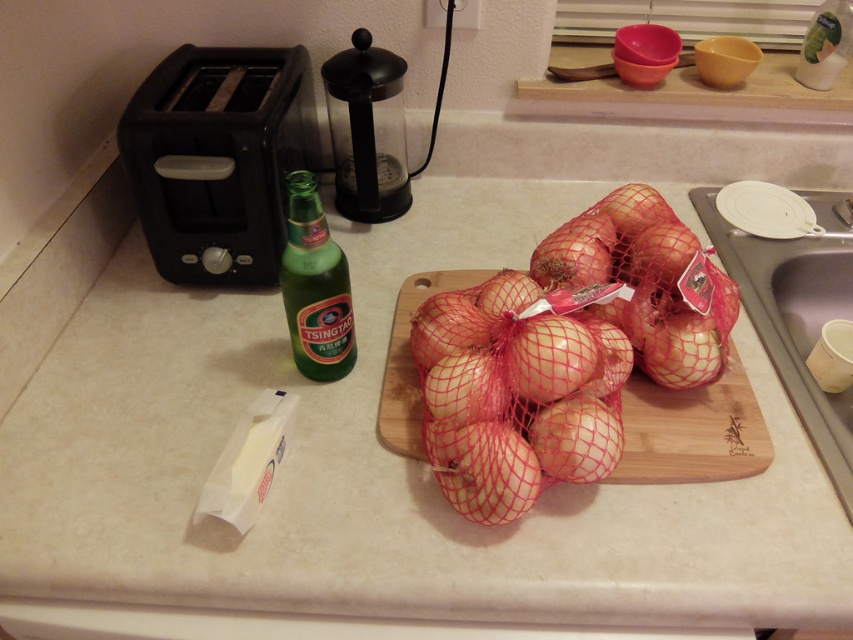
Question: Among these points, which one is nearest to the camera?

Choices:
 (A) (189, 228)
 (B) (625, 444)
 (C) (323, 296)
 (D) (798, 68)

Answer: (C)

Question: Estimate the real-world distances between objects in this image. Which object is closer to the black plastic toaster at left?

Choices:
 (A) clear plastic bottle at upper right
 (B) white mesh onion at center
 (C) wooden cutting board at center
 (D) gray metallic sink at lower right

Answer: (C)

Question: Which point appears closest to the camera in this image?

Choices:
 (A) (750, 392)
 (B) (503, 467)
 (C) (785, 268)
 (D) (805, 32)

Answer: (B)

Question: Is green glass bottle at center to the right of clear plastic bottle at upper right from the viewer's perspective?

Choices:
 (A) no
 (B) yes

Answer: (A)

Question: Can you confirm if wooden cutting board at center is smaller than gray metallic sink at lower right?

Choices:
 (A) yes
 (B) no

Answer: (A)

Question: Is white mesh onion at center bigger than clear plastic bottle at upper right?

Choices:
 (A) yes
 (B) no

Answer: (A)